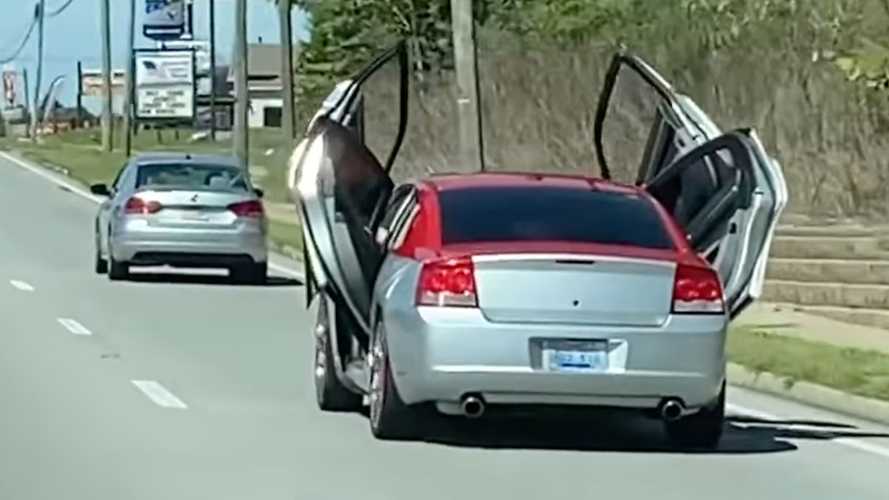
Locate an element on the screen. The width and height of the screenshot is (889, 500). stairs is located at coordinates (806, 290), (831, 273), (819, 243), (821, 233).